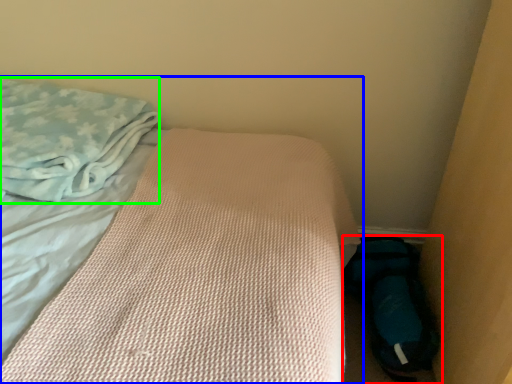
Question: Estimate the real-world distances between objects in this image. Which object is farther from footwear (highlighted by a red box), bed (highlighted by a blue box) or cloth (highlighted by a green box)?

Choices:
 (A) bed
 (B) cloth

Answer: (B)